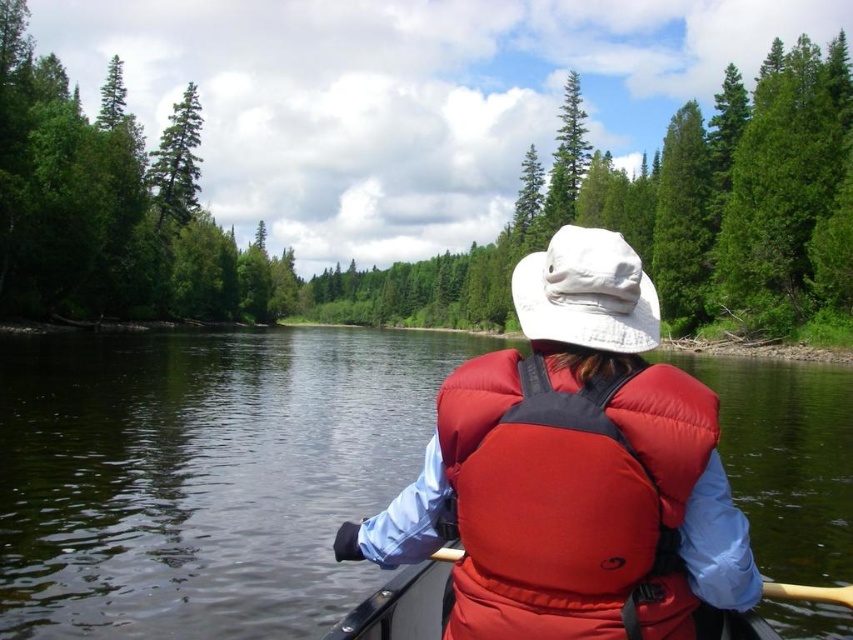
You are a photographer trying to capture the green matte tree at upper left in the center of your photo. Given its current position at point 0.253 on the horizontal axis and 0.209 on the vertical axis, what adjustment should you make to your camera to frame it centrally?

To center the green matte tree at upper left, adjust the camera so the tree moves from its current position at point 0.253 on the horizontal axis and 0.209 on the vertical axis towards the center coordinates of the image, which are typically at 0.5 on both axes. This means moving the camera to the right and downward to bring the tree into the center.

You are a safety inspector checking the canoe setup. According to the image, is the red matte life jacket at center properly positioned relative to the wooden paddle at center?

The red matte life jacket at center is located above the wooden paddle at center, which means it is positioned correctly as life jackets should be worn on top of the paddle when in use.

You are navigating a canoe on a calm river surrounded by lush greenery. You see two points marked on your GPS. The first point is at coordinate point(178, 221) and the second point is at coordinate point(358, 557). If you are facing the direction of the second point, which point is located behind you?

Point(178, 221) is behind point(358, 557), so if you are facing the direction of the second point, the first point is behind you.